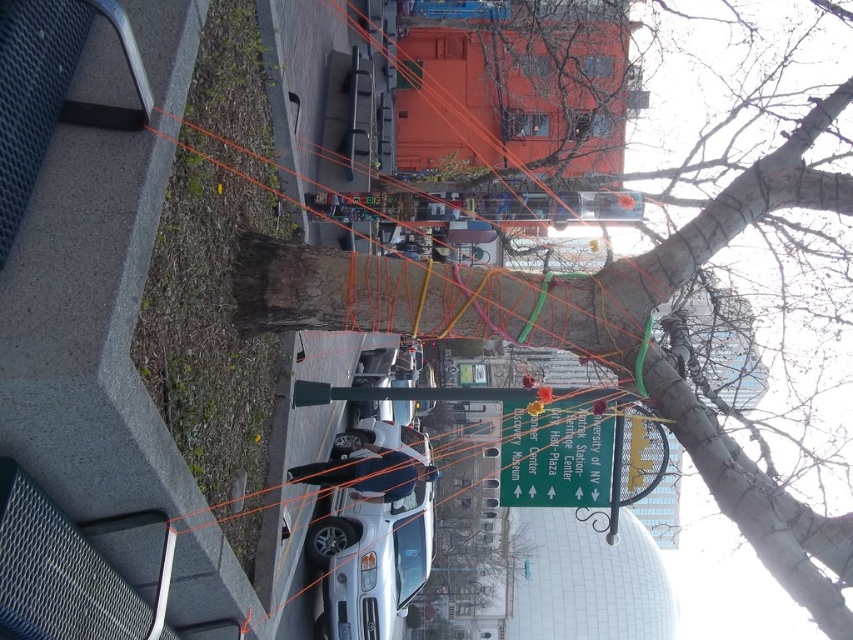
In the scene shown: You are a delivery person who needs to park your van, which is 6 meters long, in the space between the white matte car at center and the green glossy street sign at center. Can your van fit in that space?

The white matte car at center has a larger size compared to the green glossy street sign at center, but the description does not provide the exact distance between them. Therefore, it is impossible to determine if the van can fit in the space between them.

You are a delivery person trying to park your van, which is 2 meters wide, near the bark textured tree at center and the white matte car at center. Based on the scene, can your van fit between them?

The bark textured tree at center might be wider than the white matte car at center, so the space between them may not be sufficient for a 2 meter wide van. You should check the exact width before attempting to park.